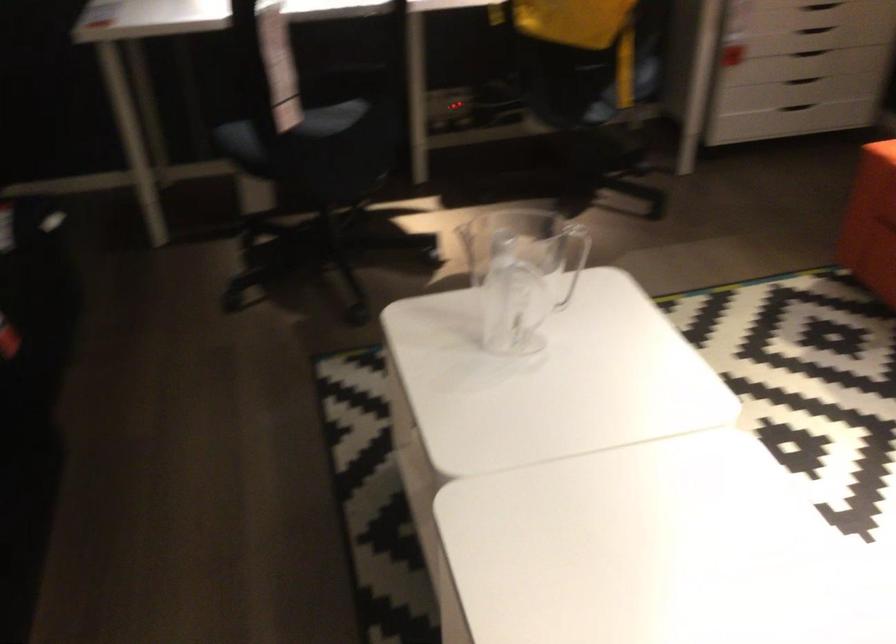
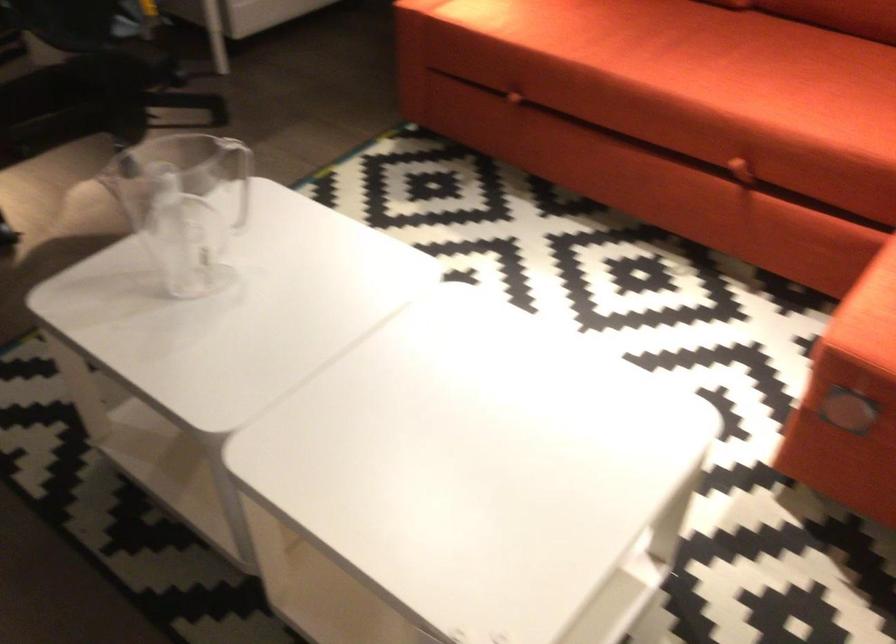
The point at (642, 261) is marked in the first image. Where is the corresponding point in the second image?

(238, 176)